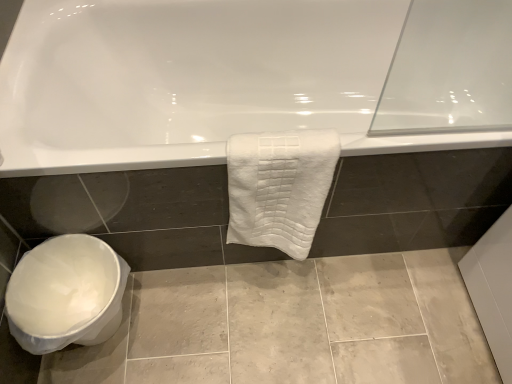
Question: From the image's perspective, is white textured towel at center below gray marble tile at lower left?

Choices:
 (A) yes
 (B) no

Answer: (B)

Question: Considering the relative positions of white textured towel at center and gray marble tile at lower left in the image provided, is white textured towel at center in front of gray marble tile at lower left?

Choices:
 (A) no
 (B) yes

Answer: (B)

Question: Is gray marble tile at lower left inside white textured towel at center?

Choices:
 (A) no
 (B) yes

Answer: (A)

Question: From the image's perspective, is white textured towel at center on gray marble tile at lower left?

Choices:
 (A) no
 (B) yes

Answer: (B)

Question: Can you confirm if white textured towel at center is bigger than gray marble tile at lower left?

Choices:
 (A) no
 (B) yes

Answer: (B)

Question: Are white textured towel at center and gray marble tile at lower left located far from each other?

Choices:
 (A) no
 (B) yes

Answer: (A)

Question: Does gray marble tile at lower left turn towards white glossy bathtub at upper center?

Choices:
 (A) no
 (B) yes

Answer: (A)

Question: Considering the relative sizes of gray marble tile at lower left and white glossy bathtub at upper center in the image provided, is gray marble tile at lower left smaller than white glossy bathtub at upper center?

Choices:
 (A) yes
 (B) no

Answer: (A)

Question: From a real-world perspective, is gray marble tile at lower left located beneath white glossy bathtub at upper center?

Choices:
 (A) no
 (B) yes

Answer: (B)

Question: Is gray marble tile at lower left shorter than white glossy bathtub at upper center?

Choices:
 (A) no
 (B) yes

Answer: (B)

Question: Considering the relative sizes of gray marble tile at lower left and white glossy bathtub at upper center in the image provided, is gray marble tile at lower left wider than white glossy bathtub at upper center?

Choices:
 (A) yes
 (B) no

Answer: (A)

Question: Is gray marble tile at lower left positioned beyond the bounds of white glossy bathtub at upper center?

Choices:
 (A) no
 (B) yes

Answer: (B)

Question: From a real-world perspective, is white glossy bathtub at upper center on gray marble tile at lower left?

Choices:
 (A) yes
 (B) no

Answer: (A)